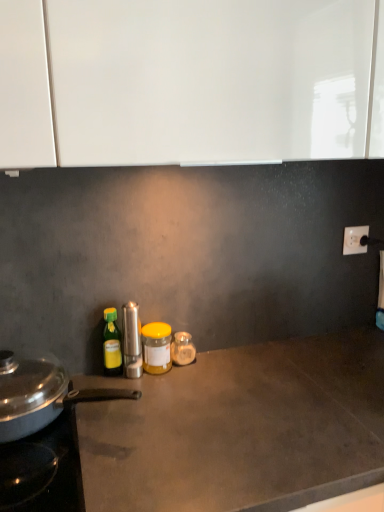
Where is `vacant space to the right of satin silver pepper mill at center, the 1th kitchen appliance positioned from the right`? vacant space to the right of satin silver pepper mill at center, the 1th kitchen appliance positioned from the right is located at coordinates (198, 381).